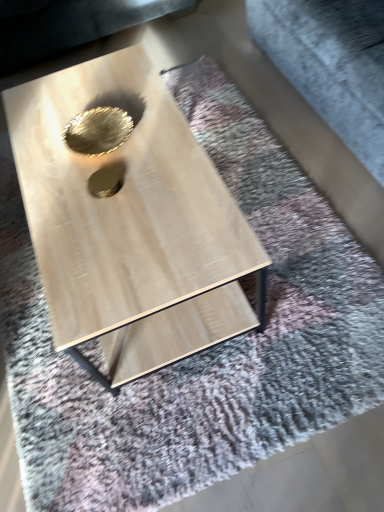
Locate an element on the screen. free spot in front of light wood/texture coffee table at center is located at coordinates (180, 412).